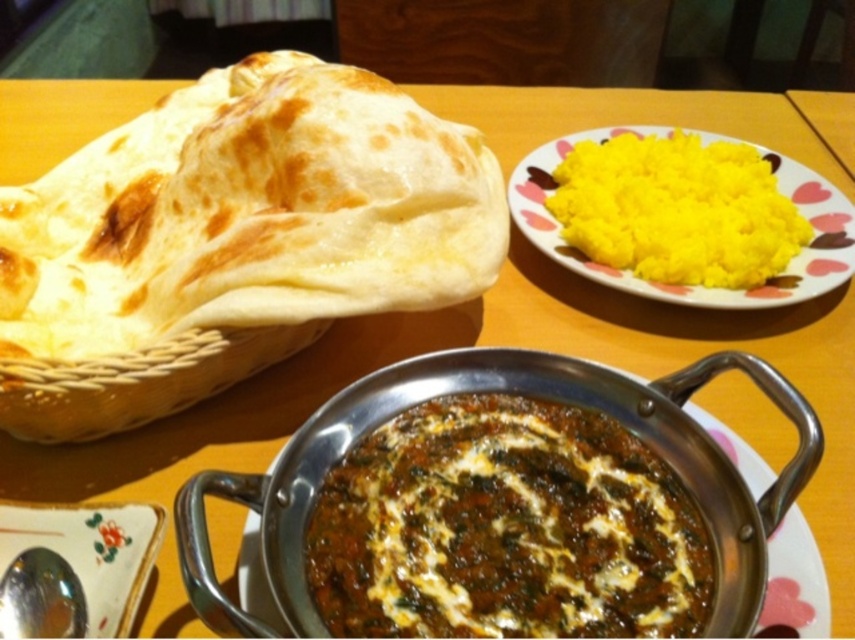
Can you confirm if golden brown dough at left is positioned above brown matte curry at center?

Yes.

Who is more forward, (181, 125) or (405, 472)?

Point (405, 472)

Is point (52, 260) more distant than point (478, 632)?

Yes, it is.

Where is `golden brown dough at left`? This screenshot has height=640, width=855. golden brown dough at left is located at coordinates (251, 212).

Looking at this image, how distant is golden brown dough at left from yellow fluffy rice at upper right?

golden brown dough at left is 10.25 inches away from yellow fluffy rice at upper right.

Which of these two, golden brown dough at left or yellow fluffy rice at upper right, stands shorter?

yellow fluffy rice at upper right

Find the location of a particular element. This screenshot has height=640, width=855. golden brown dough at left is located at coordinates (251, 212).

This screenshot has width=855, height=640. Find the location of `golden brown dough at left`. golden brown dough at left is located at coordinates (251, 212).

Who is more forward, (440,602) or (86,577)?

Point (440,602)

The image size is (855, 640). What are the coordinates of `brown matte curry at center` in the screenshot? It's located at (506, 529).

Who is more distant from viewer, (404, 486) or (150, 509)?

Point (150, 509)

At what (x,y) coordinates should I click in order to perform the action: click on brown matte curry at center. Please return your answer as a coordinate pair (x, y). Looking at the image, I should click on (506, 529).